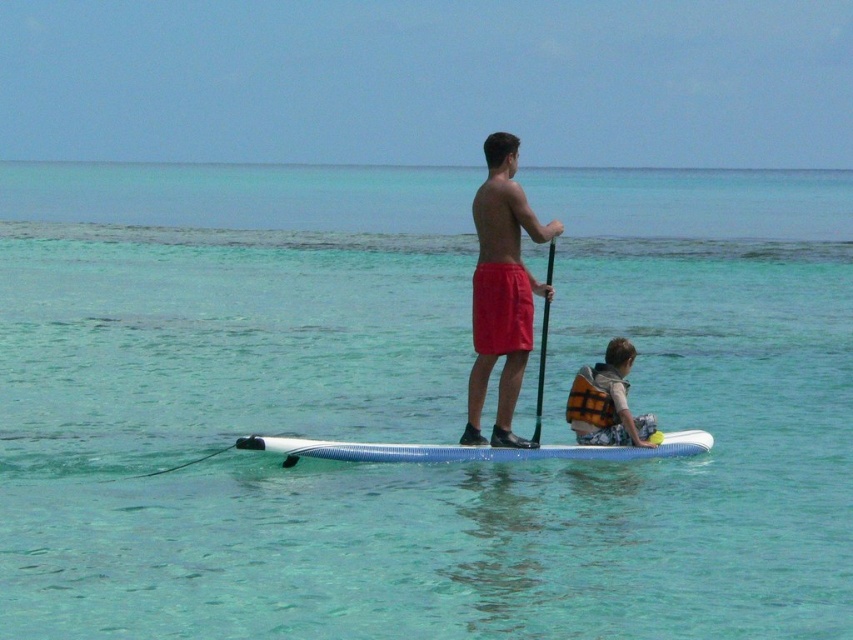
You are standing on the shore and want to take a photo of the paddleboarders. The camera you have can focus up to 15 meters. Is the point at coordinates point [579,426] within the camera focus range?

The distance of point [579,426] from camera is 15.63 meters, which exceeds the camera focus limit of 15 meters. Therefore, the point is outside the focus range.

You are a lifeguard observing the scene. You notice the clear blue water at center and the matte red shorts at center. Which object appears higher in the image?

The clear blue water at center is taller than the matte red shorts at center, so the clear blue water at center appears higher in the image.

You are a photographer trying to capture a photo of the clear blue water at center and the matte red shorts at center from the shore. Which object will appear closer to the camera in the photo?

The clear blue water at center appears closer to the camera because it is in front of the matte red shorts at center.